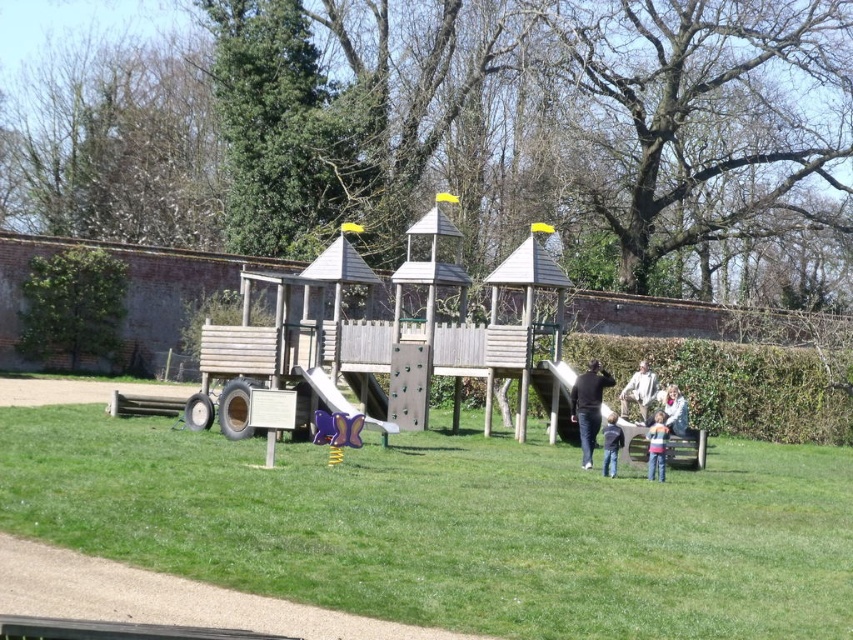
Question: Can you confirm if wooden playground at center is positioned to the left of blue denim jeans at center?

Choices:
 (A) no
 (B) yes

Answer: (B)

Question: Where is black matte jacket at center located in relation to purple plastic slide at center in the image?

Choices:
 (A) right
 (B) left

Answer: (A)

Question: Is the position of black matte jacket at center less distant than that of purple plastic slide at center?

Choices:
 (A) no
 (B) yes

Answer: (B)

Question: Which point is closer to the camera taking this photo?

Choices:
 (A) (666, 397)
 (B) (611, 428)
 (C) (648, 477)

Answer: (C)

Question: Which point is farther from the camera taking this photo?

Choices:
 (A) (434, 483)
 (B) (614, 451)
 (C) (590, 410)

Answer: (C)

Question: Which of these objects is positioned closest to the wooden playground at center?

Choices:
 (A) blue denim jeans at center
 (B) white fuzzy jacket at lower right
 (C) white fabric jacket at center
 (D) black matte jacket at center

Answer: (A)